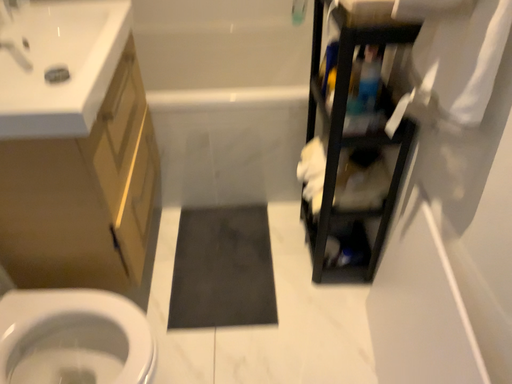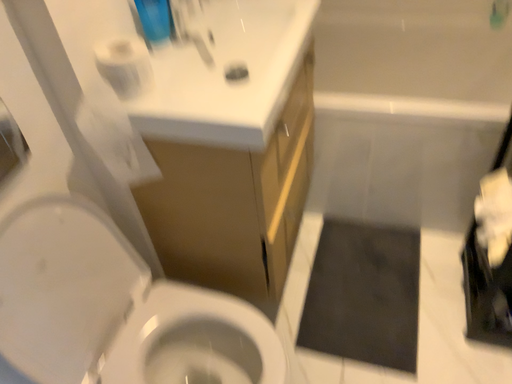
Question: Which way did the camera rotate in the video?

Choices:
 (A) rotated right
 (B) rotated left

Answer: (B)